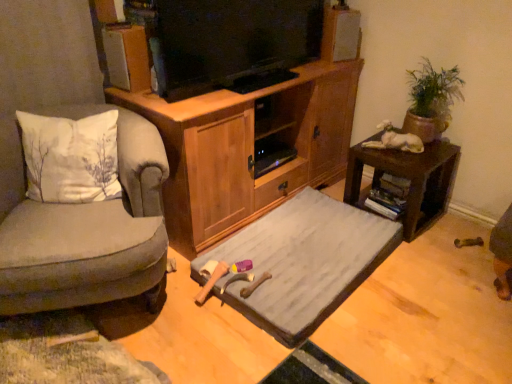
This screenshot has width=512, height=384. I want to click on vacant area on top of brown wooden desk at right (from a real-world perspective), so click(410, 146).